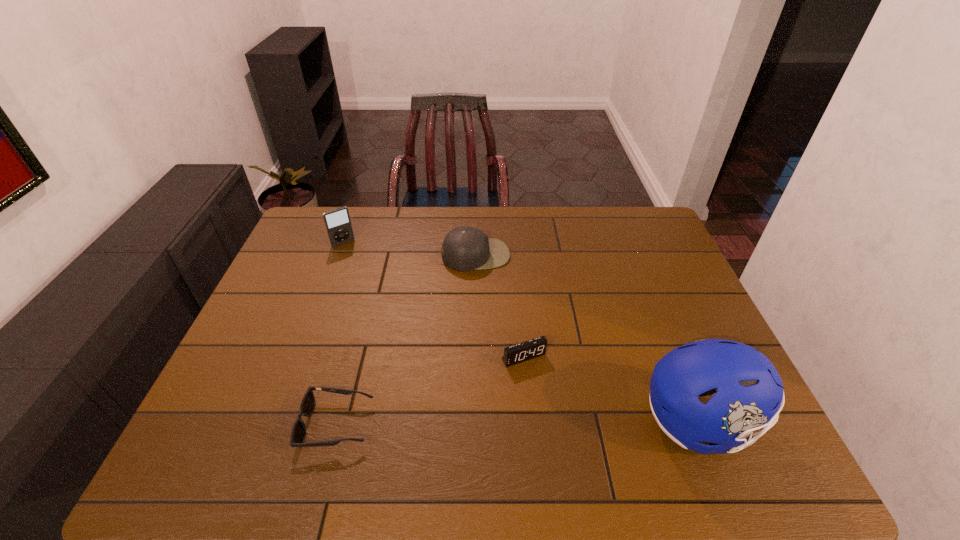
The image size is (960, 540). I want to click on free space located 0.160m on the front-facing side of the shortest object, so click(231, 424).

This screenshot has width=960, height=540. Identify the location of vacant space located 0.170m on the front-facing side of the shortest object. (227, 424).

The width and height of the screenshot is (960, 540). Find the location of `vacant space situated on the front-facing side of the iPod`. vacant space situated on the front-facing side of the iPod is located at coordinates (368, 275).

The width and height of the screenshot is (960, 540). I want to click on vacant region located 0.380m on the front-facing side of the iPod, so click(396, 317).

At what (x,y) coordinates should I click in order to perform the action: click on vacant space located 0.110m on the front-facing side of the iPod. Please return your answer as a coordinate pair (x, y). Looking at the image, I should click on (360, 265).

At what (x,y) coordinates should I click in order to perform the action: click on free spot located 0.130m on the brim of the cap. Please return your answer as a coordinate pair (x, y). This screenshot has width=960, height=540. Looking at the image, I should click on (493, 300).

Where is `vacant space located 0.300m on the brim of the cap`? The height and width of the screenshot is (540, 960). vacant space located 0.300m on the brim of the cap is located at coordinates (509, 345).

Where is `free region located on the brim of the cap`? Image resolution: width=960 pixels, height=540 pixels. free region located on the brim of the cap is located at coordinates tap(488, 284).

You are a GUI agent. You are given a task and a screenshot of the screen. Output one action in this format:
    pyautogui.click(x=<x>, y=<y>)
    Task: Click on the free space located 0.060m on the front-facing side of the third farthest object
    The width and height of the screenshot is (960, 540).
    Given the screenshot: What is the action you would take?
    pyautogui.click(x=543, y=386)

Identify the location of vacant space located on the front-facing side of the third farthest object. (556, 406).